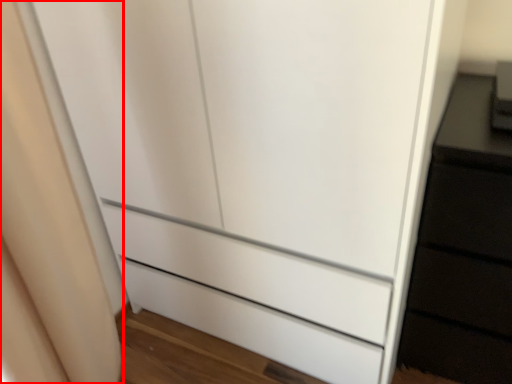
Question: From the image's perspective, where is curtain (annotated by the red box) located relative to appliance?

Choices:
 (A) below
 (B) above

Answer: (A)